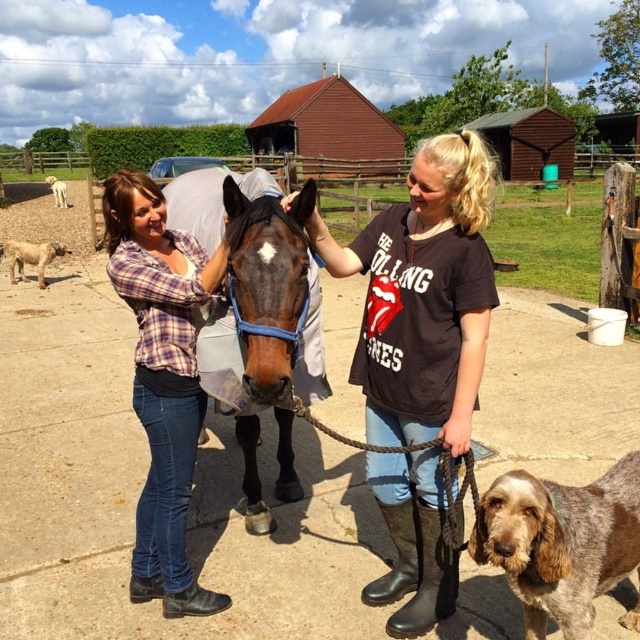
Question: Which of the following is the farthest from the observer?

Choices:
 (A) plaid shirt at center
 (B) brown matte shirt at center
 (C) speckled fur dog at lower right

Answer: (A)

Question: Based on their relative distances, which object is farther from the brown glossy horse at center?

Choices:
 (A) plaid shirt at center
 (B) speckled fur dog at lower right
 (C) brown matte shirt at center

Answer: (B)

Question: Does speckled fur dog at lower right have a greater width compared to white fluffy dog at upper left?

Choices:
 (A) yes
 (B) no

Answer: (B)

Question: Considering the relative positions of brown glossy horse at center and white fluffy dog at upper left in the image provided, where is brown glossy horse at center located with respect to white fluffy dog at upper left?

Choices:
 (A) below
 (B) above

Answer: (A)

Question: Which point is closer to the camera?

Choices:
 (A) (58, 205)
 (B) (269, 212)
 (C) (122, 282)

Answer: (B)

Question: Is speckled fur dog at lower right positioned in front of light brown fur at lower left?

Choices:
 (A) no
 (B) yes

Answer: (B)